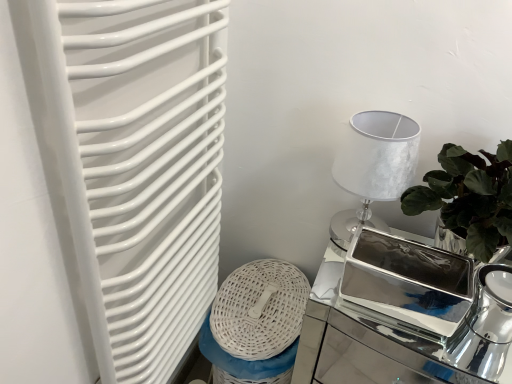
Question: From the image's perspective, is silver metallic table lamp at upper right above or below polished silver tea pot at right?

Choices:
 (A) below
 (B) above

Answer: (B)

Question: Considering the positions of silver metallic table lamp at upper right and polished silver tea pot at right in the image, is silver metallic table lamp at upper right bigger or smaller than polished silver tea pot at right?

Choices:
 (A) big
 (B) small

Answer: (A)

Question: Which of these objects is positioned closest to the silver metallic table lamp at upper right?

Choices:
 (A) white glossy radiator at left
 (B) polished silver tea pot at right
 (C) polished silver tray at right

Answer: (B)

Question: Which object is positioned closest to the silver metallic table lamp at upper right?

Choices:
 (A) white glossy radiator at left
 (B) polished silver tray at right
 (C) polished silver tea pot at right

Answer: (C)